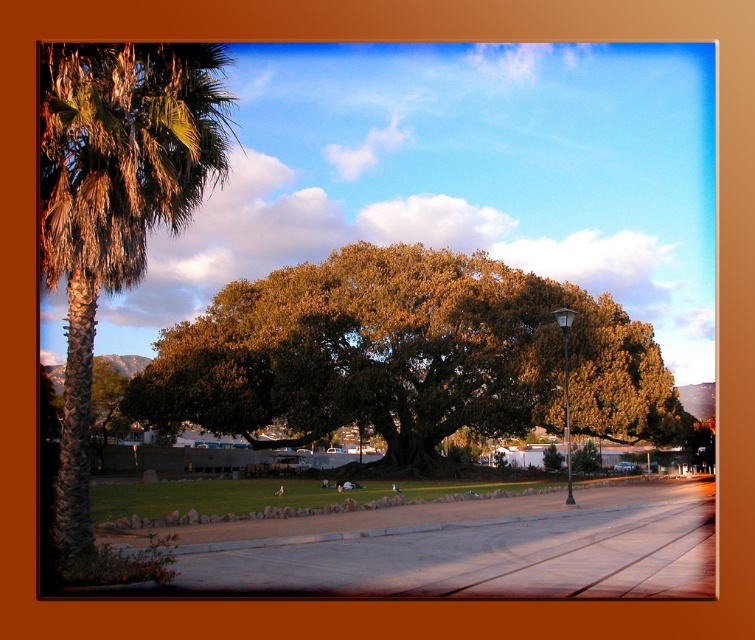
Describe the element at coordinates (405, 356) in the screenshot. This screenshot has width=755, height=640. I see `green leafy oak at center` at that location.

Based on the photo, is green leafy oak at center bigger than green leafy palm at left?

No.

Where is `green leafy oak at center`? The height and width of the screenshot is (640, 755). green leafy oak at center is located at coordinates (405, 356).